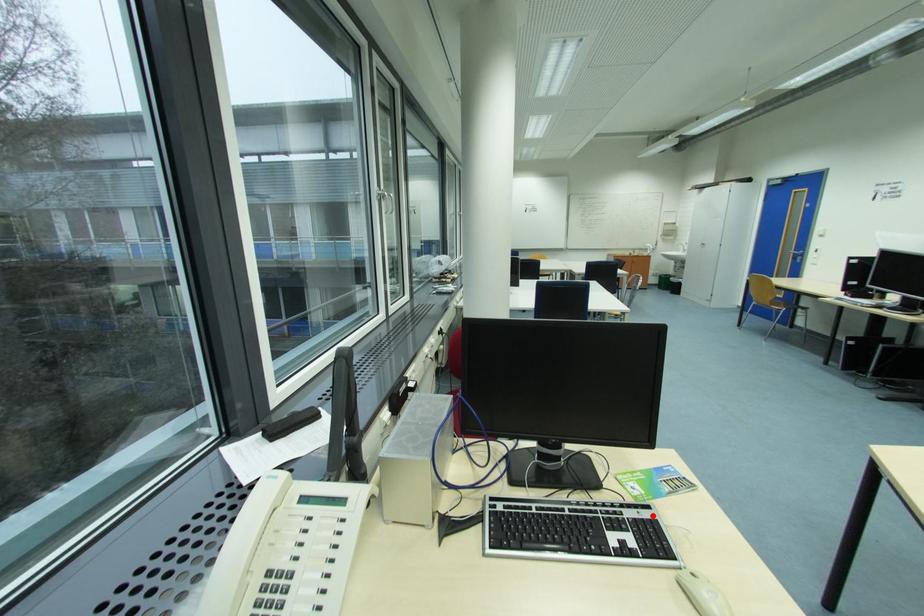
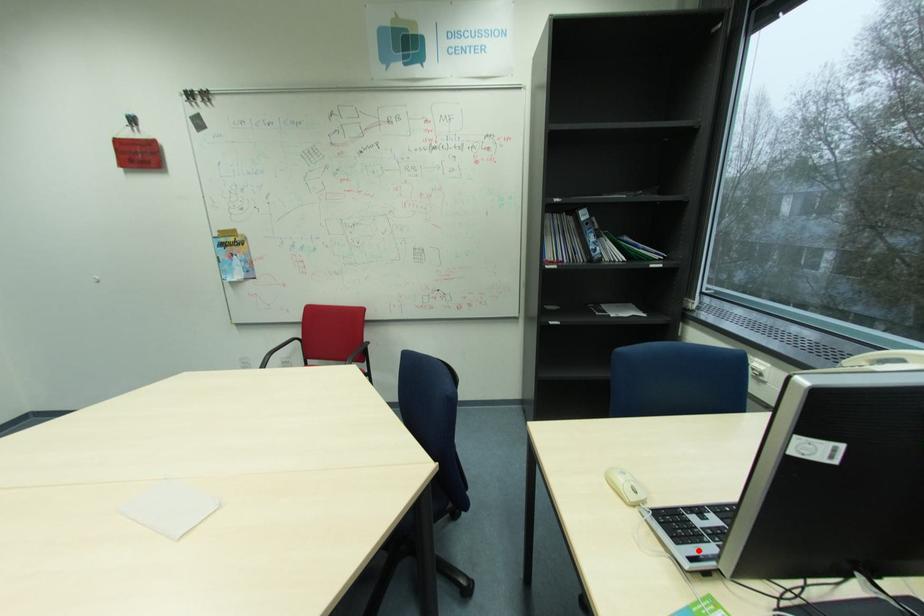
I am providing you with two images of the same scene from different viewpoints. A red point is marked on the first image and another point is marked on the second image. Does the point marked in image1 correspond to the same location as the one in image2?

Yes